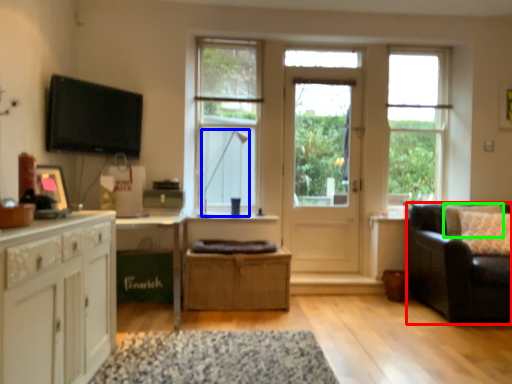
Question: Which is nearer to the studio couch (highlighted by a red box)? lamp (highlighted by a blue box) or pillow (highlighted by a green box).

Choices:
 (A) lamp
 (B) pillow

Answer: (B)